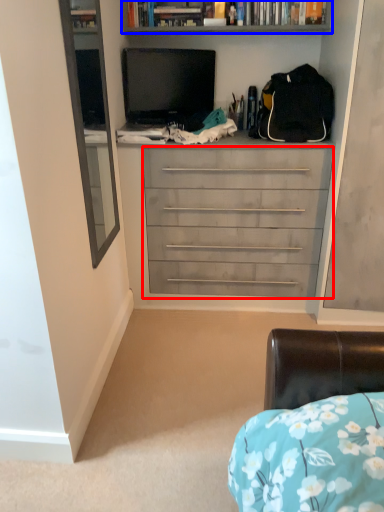
Question: Which of the following is the closest to the observer, chest of drawers (highlighted by a red box) or bookcase (highlighted by a blue box)?

Choices:
 (A) chest of drawers
 (B) bookcase

Answer: (A)